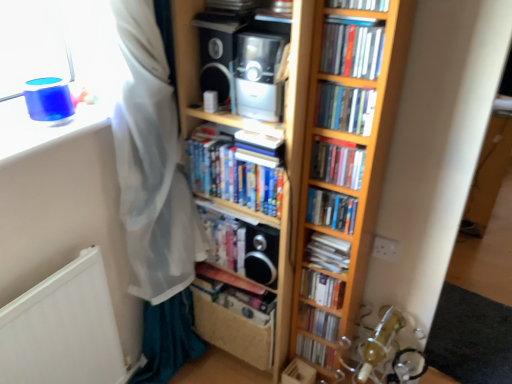
Question: Is hardcover book at center, positioned as the fourth book in bottom-to-top order, completely or partially outside of matte black speaker at upper center, which is the 1th speaker from left to right?

Choices:
 (A) no
 (B) yes

Answer: (B)

Question: Is hardcover book at center, positioned as the fourth book in bottom-to-top order, placed right next to matte black speaker at upper center, the 2th speaker ordered from the bottom?

Choices:
 (A) no
 (B) yes

Answer: (A)

Question: Considering the relative sizes of hardcover book at center, acting as the 9th book starting from the top, and matte black speaker at upper center, the 1th speaker when ordered from top to bottom, in the image provided, is hardcover book at center, acting as the 9th book starting from the top, shorter than matte black speaker at upper center, the 1th speaker when ordered from top to bottom,?

Choices:
 (A) no
 (B) yes

Answer: (B)

Question: Considering the relative sizes of hardcover book at center, positioned as the fourth book in bottom-to-top order, and matte black speaker at upper center, which is the 1th speaker from left to right, in the image provided, is hardcover book at center, positioned as the fourth book in bottom-to-top order, smaller than matte black speaker at upper center, which is the 1th speaker from left to right,?

Choices:
 (A) no
 (B) yes

Answer: (B)

Question: In the image, is white paper book at center, arranged as the 8th book when viewed from the top, on the left side or the right side of hardcover book at center, placed as the fourth book when sorted from top to bottom?

Choices:
 (A) right
 (B) left

Answer: (B)

Question: Considering the positions of white paper book at center, arranged as the 8th book when viewed from the top, and hardcover book at center, arranged as the ninth book when ordered from the bottom, in the image, is white paper book at center, arranged as the 8th book when viewed from the top, bigger or smaller than hardcover book at center, arranged as the ninth book when ordered from the bottom,?

Choices:
 (A) big
 (B) small

Answer: (B)

Question: From the image's perspective, is white paper book at center, arranged as the 8th book when viewed from the top, located above or below hardcover book at center, placed as the fourth book when sorted from top to bottom?

Choices:
 (A) below
 (B) above

Answer: (A)

Question: Is white paper book at center, which is counted as the 5th book, starting from the bottom, wider or thinner than hardcover book at center, arranged as the ninth book when ordered from the bottom?

Choices:
 (A) wide
 (B) thin

Answer: (A)

Question: Does point (335, 4) appear closer or farther from the camera than point (304, 311)?

Choices:
 (A) closer
 (B) farther

Answer: (A)

Question: Looking at the image, does hardcover book at upper center, marked as the 12th book in a bottom-to-top arrangement, seem bigger or smaller compared to hardcover book at center, which is the 11th book in top-to-bottom order?

Choices:
 (A) big
 (B) small

Answer: (A)

Question: From a real-world perspective, is hardcover book at upper center, marked as the 12th book in a bottom-to-top arrangement, above or below hardcover book at center, the second book positioned from the bottom?

Choices:
 (A) above
 (B) below

Answer: (A)

Question: Is hardcover book at upper center, which ranks as the 1th book in top-to-bottom order, taller or shorter than hardcover book at center, the second book positioned from the bottom?

Choices:
 (A) tall
 (B) short

Answer: (A)

Question: Would you say white paper book at center, which is counted as the 5th book, starting from the bottom, is inside or outside hardcover book at center, the second book positioned from the bottom?

Choices:
 (A) outside
 (B) inside

Answer: (A)

Question: In the image, is white paper book at center, arranged as the 8th book when viewed from the top, on the left side or the right side of hardcover book at center, which is the 11th book in top-to-bottom order?

Choices:
 (A) right
 (B) left

Answer: (A)